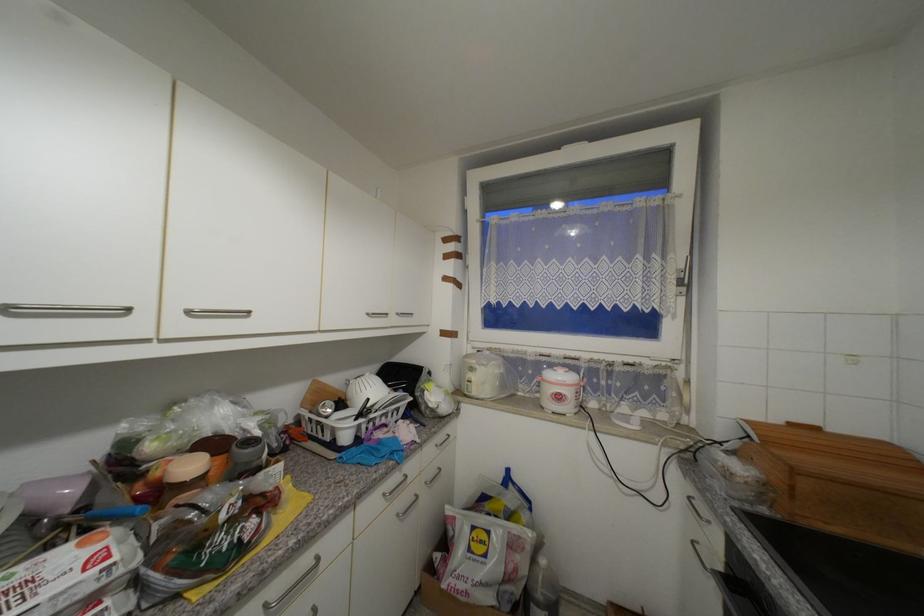
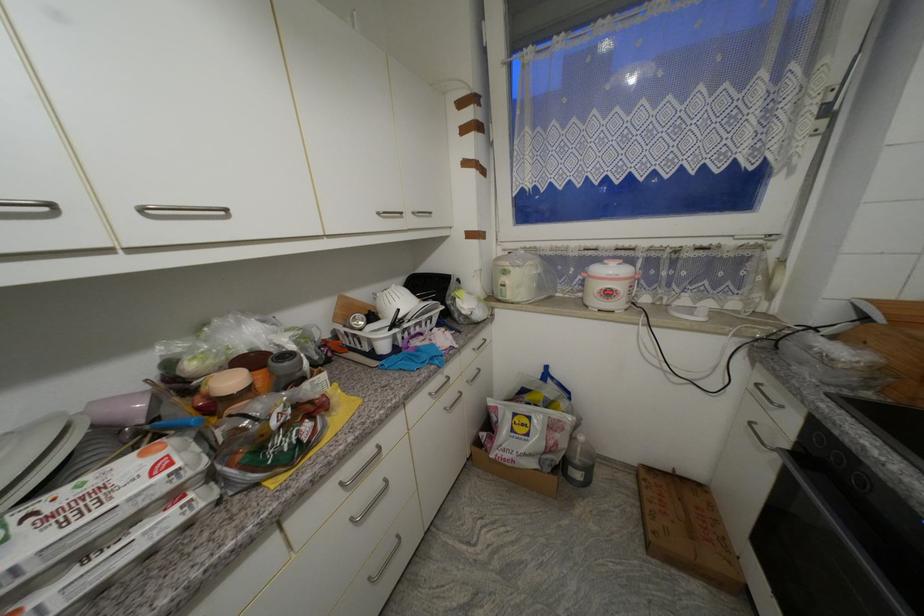
Find the pixel in the second image that matches (x=408, y=501) in the first image.

(455, 398)